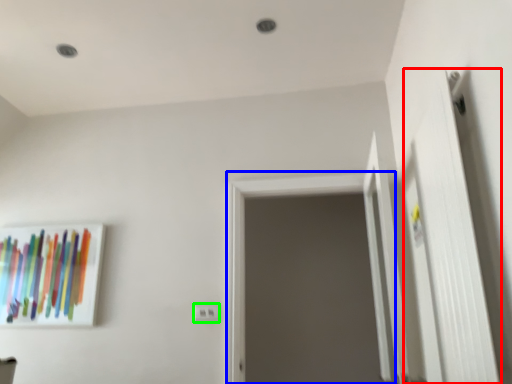
Question: Considering the real-world distances, which object is farthest from door (highlighted by a red box)? screen door (highlighted by a blue box) or electric outlet (highlighted by a green box)?

Choices:
 (A) screen door
 (B) electric outlet

Answer: (B)